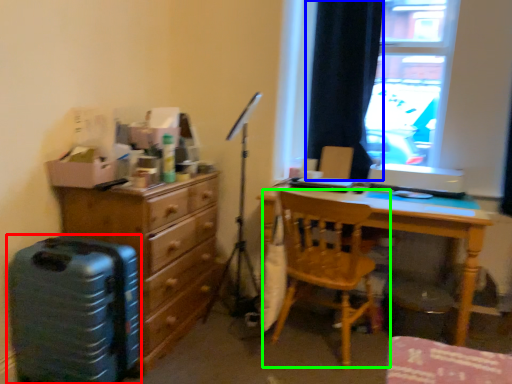
Question: Considering the real-world distances, which object is closest to luggage (highlighted by a red box)? curtain (highlighted by a blue box) or chair (highlighted by a green box).

Choices:
 (A) curtain
 (B) chair

Answer: (B)